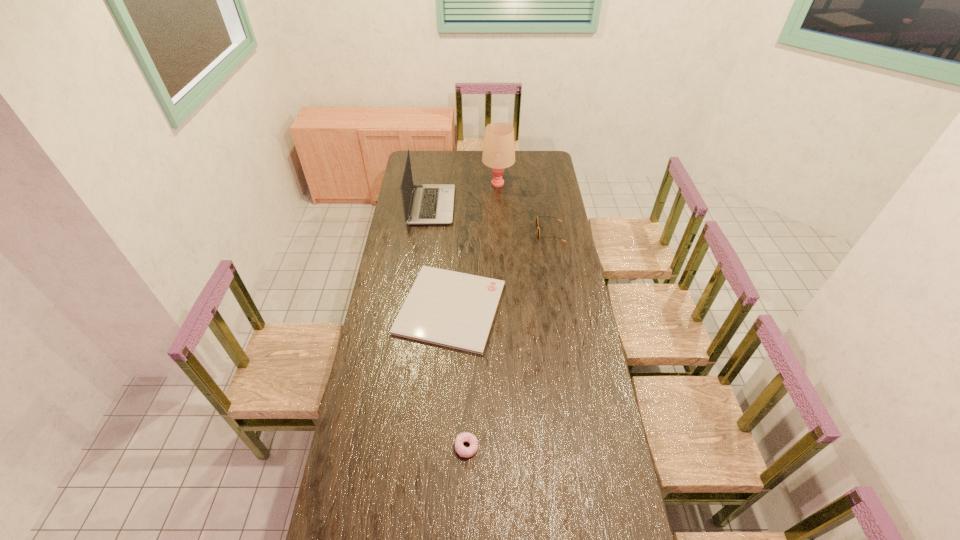
Find the location of a particular element. The image size is (960, 540). free spot located on the front-facing side of the third shortest object is located at coordinates (506, 233).

Locate an element on the screen. The width and height of the screenshot is (960, 540). blank space located 0.070m on the front-facing side of the third shortest object is located at coordinates (523, 233).

In order to click on vacant space situated on the front-facing side of the third shortest object in this screenshot , I will do `click(517, 233)`.

Identify the location of free space located on the front of the nearest object. The height and width of the screenshot is (540, 960). (466, 484).

Identify the location of vacant space situated 0.080m on the right of the clipboard. Image resolution: width=960 pixels, height=540 pixels. (524, 308).

I want to click on laptop computer located at the left edge, so click(x=430, y=204).

You are a GUI agent. You are given a task and a screenshot of the screen. Output one action in this format:
    pyautogui.click(x=<x>, y=<y>)
    Task: Click on the clipboard that is at the left edge
    The height and width of the screenshot is (540, 960).
    Given the screenshot: What is the action you would take?
    pyautogui.click(x=452, y=309)

Identify the location of object that is at the right edge. (537, 216).

The image size is (960, 540). I want to click on vacant space at the far edge of the desktop, so [x=452, y=166].

The width and height of the screenshot is (960, 540). I want to click on vacant space at the left edge, so click(393, 269).